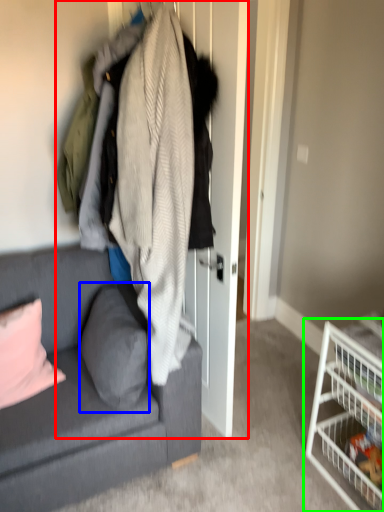
Question: Estimate the real-world distances between objects in this image. Which object is closer to closet (highlighted by a red box), pillow (highlighted by a blue box) or shelf (highlighted by a green box)?

Choices:
 (A) pillow
 (B) shelf

Answer: (A)